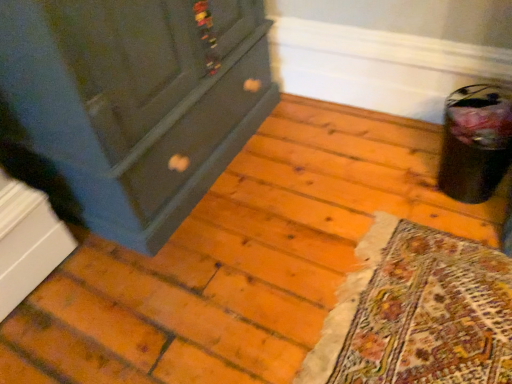
What is the approximate width of black plastic bag at right?

The width of black plastic bag at right is 9.16 inches.

The height and width of the screenshot is (384, 512). Find the location of `black plastic bag at right`. black plastic bag at right is located at coordinates (475, 143).

What do you see at coordinates (475, 143) in the screenshot? I see `black plastic bag at right` at bounding box center [475, 143].

Measure the distance between point (476, 193) and camera.

The depth of point (476, 193) is 4.19 feet.

I want to click on black plastic bag at right, so click(475, 143).